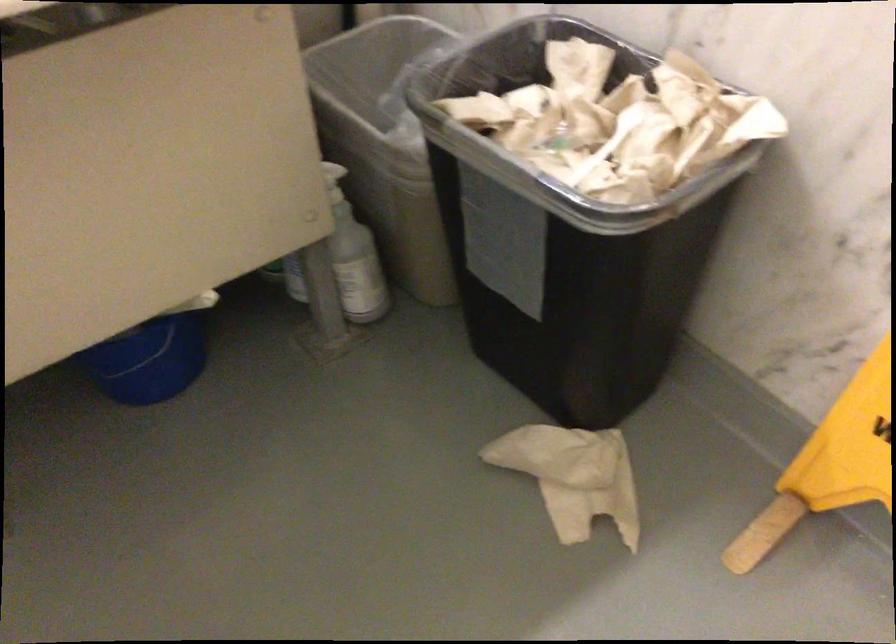
At what (x,y) coordinates should I click in order to perform the action: click on spray bottle trigger. Please return your answer as a coordinate pair (x, y). The width and height of the screenshot is (896, 644). Looking at the image, I should click on (333, 182).